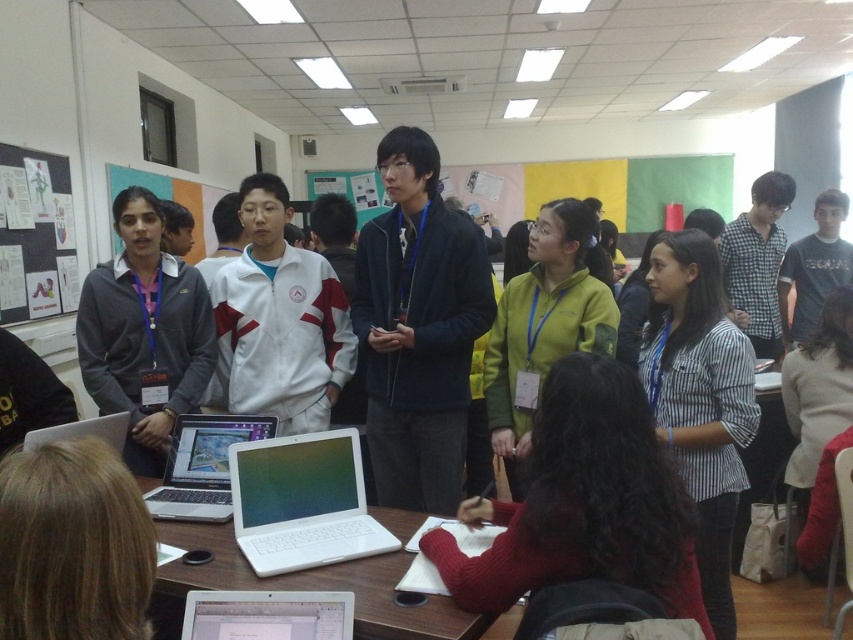
You are a participant in the meeting and need to reach the silver metallic laptop at center to present a slide. If your arm can extend 1.5 meters, can you reach it without moving from your current position?

The silver metallic laptop at center is 1.96 meters away from the camera, so your arm cannot reach it since it can only extend 1.5 meters. You need to move closer to reach it.

You are attending a workshop and need to locate the presenter who is wearing a striped cotton shirt at center. There is also a white glossy laptop at center on the table. From the perspective of someone facing the front of the room, which object is positioned to the left?

The white glossy laptop at center is positioned to the left of the striped cotton shirt at center.